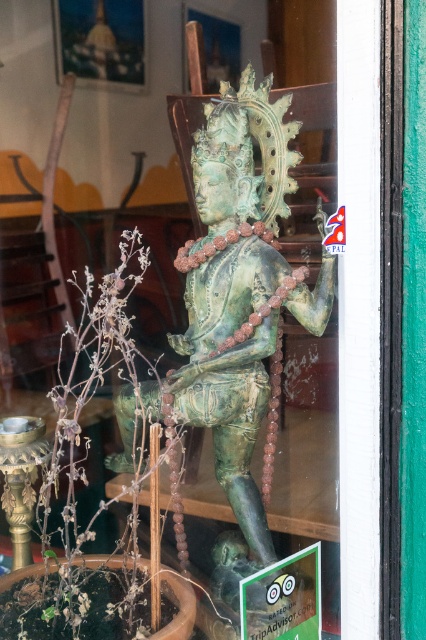
Question: Which point appears closest to the camera in this image?

Choices:
 (A) click(x=226, y=465)
 (B) click(x=131, y=369)

Answer: (B)

Question: Does green patina statue at center have a larger size compared to green leafy plant at center?

Choices:
 (A) yes
 (B) no

Answer: (B)

Question: Is green patina statue at center positioned in front of green leafy plant at center?

Choices:
 (A) yes
 (B) no

Answer: (B)

Question: Does green patina statue at center appear on the left side of green leafy plant at center?

Choices:
 (A) no
 (B) yes

Answer: (A)

Question: Which object is farther from the camera taking this photo?

Choices:
 (A) green patina statue at center
 (B) green leafy plant at center

Answer: (A)